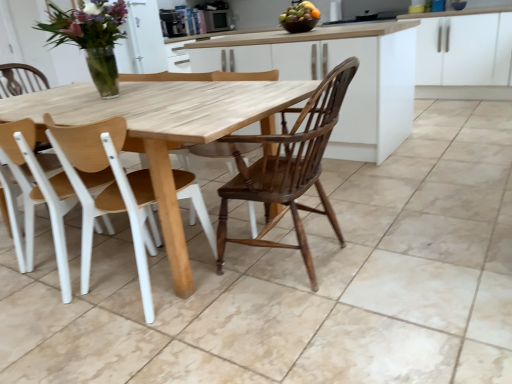
Question: Is wooden at center, the 1th chair when ordered from right to left, not inside glossy ceramic bowl at upper center?

Choices:
 (A) yes
 (B) no

Answer: (A)

Question: Considering the relative sizes of wooden at center, the 1th chair when ordered from right to left, and glossy ceramic bowl at upper center in the image provided, is wooden at center, the 1th chair when ordered from right to left, wider than glossy ceramic bowl at upper center?

Choices:
 (A) yes
 (B) no

Answer: (A)

Question: Is glossy ceramic bowl at upper center a part of wooden at center, the 2th chair viewed from the left?

Choices:
 (A) yes
 (B) no

Answer: (B)

Question: Is wooden at center, the 2th chair viewed from the left, in front of glossy ceramic bowl at upper center?

Choices:
 (A) no
 (B) yes

Answer: (B)

Question: Does wooden at center, the 1th chair when ordered from right to left, turn towards glossy ceramic bowl at upper center?

Choices:
 (A) no
 (B) yes

Answer: (B)

Question: From the image's perspective, does wooden at center, the 1th chair when ordered from right to left, appear lower than glossy ceramic bowl at upper center?

Choices:
 (A) yes
 (B) no

Answer: (A)

Question: Considering the relative positions of glossy ceramic bowl at upper center and white matte cabinet at upper right in the image provided, is glossy ceramic bowl at upper center in front of white matte cabinet at upper right?

Choices:
 (A) no
 (B) yes

Answer: (B)

Question: From a real-world perspective, is glossy ceramic bowl at upper center below white matte cabinet at upper right?

Choices:
 (A) yes
 (B) no

Answer: (B)

Question: Is glossy ceramic bowl at upper center behind white matte cabinet at upper right?

Choices:
 (A) yes
 (B) no

Answer: (B)

Question: Can you confirm if glossy ceramic bowl at upper center is positioned to the right of white matte cabinet at upper right?

Choices:
 (A) yes
 (B) no

Answer: (B)

Question: Is glossy ceramic bowl at upper center not near white matte cabinet at upper right?

Choices:
 (A) no
 (B) yes

Answer: (B)

Question: Could you tell me if glossy ceramic bowl at upper center is turned towards white matte cabinet at upper right?

Choices:
 (A) yes
 (B) no

Answer: (B)

Question: Is clear glass vase at upper left closer to camera compared to white plastic chair at left, acting as the second chair starting from the right?

Choices:
 (A) no
 (B) yes

Answer: (A)